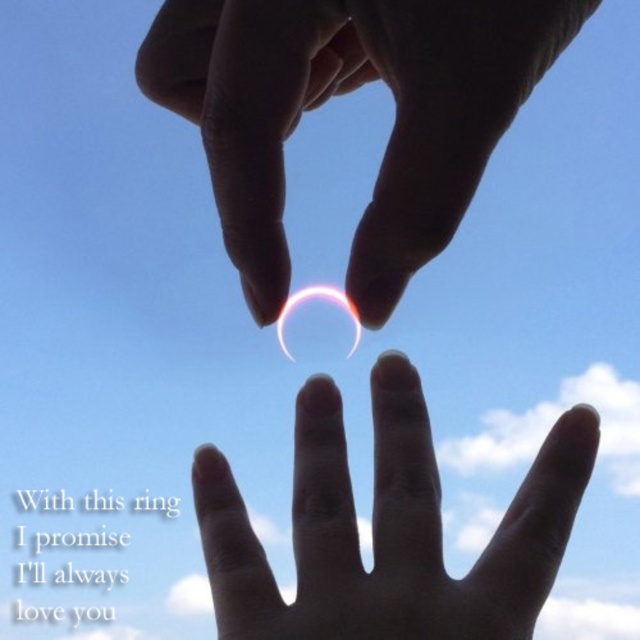
Consider the image. You are a photographer trying to capture the ring in the center of the image. Given that the point representing the ring is at coordinate point (342, 93), can you determine if the ring is closer to the top or bottom of the image?

The ring at point (342, 93) is closer to the bottom of the image since the y coordinate 0.536 is closer to 0.5 than 1.0, meaning it is near the middle vertically, but since the coordinate system starts at the bottom, 0.536 would be slightly above the center, so actually closer to the top.

You are designing a greeting card and want to ensure the translucent glass heart at center is placed between the smooth skin hand at center and the edge of the card. Given the size difference, which object should be closer to the edge?

The translucent glass heart at center should be closer to the edge because its smaller width allows it to fit nearer to the card edge while still being positioned between the smooth skin hand at center and the edge.